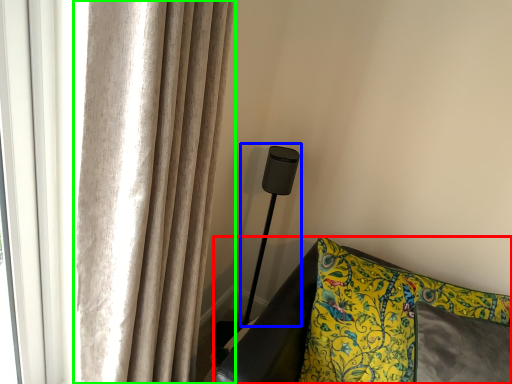
Question: Estimate the real-world distances between objects in this image. Which object is closer to furniture (highlighted by a red box), table lamp (highlighted by a blue box) or curtain (highlighted by a green box)?

Choices:
 (A) table lamp
 (B) curtain

Answer: (A)